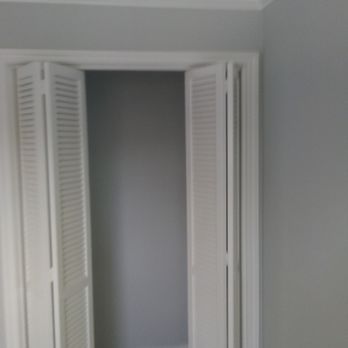
Where is `ceiling`? ceiling is located at coordinates (227, 1).